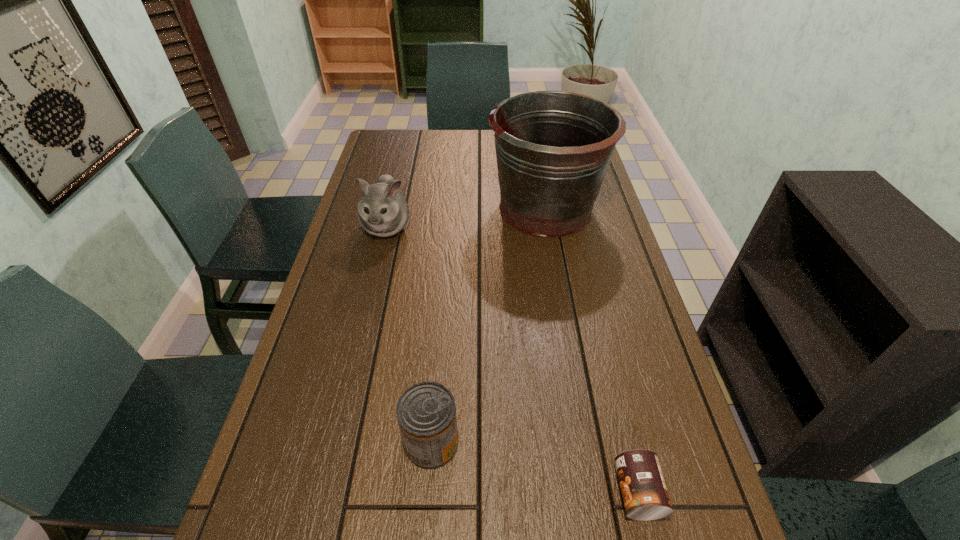
The height and width of the screenshot is (540, 960). Find the location of `empty location between the tallest object and the hamster`. empty location between the tallest object and the hamster is located at coordinates (466, 218).

You are a GUI agent. You are given a task and a screenshot of the screen. Output one action in this format:
    pyautogui.click(x=<x>, y=<y>)
    Task: Click on the free space between the third shortest object and the bucket
    This screenshot has height=540, width=960.
    Given the screenshot: What is the action you would take?
    (466, 218)

Where is `vacant point located between the bucket and the hamster`? The image size is (960, 540). vacant point located between the bucket and the hamster is located at coordinates pyautogui.click(x=466, y=218).

Find the location of `unoccupied position between the hamster and the right can`. unoccupied position between the hamster and the right can is located at coordinates (512, 359).

The width and height of the screenshot is (960, 540). In order to click on empty space that is in between the taller can and the bucket in this screenshot , I will do click(x=489, y=326).

Image resolution: width=960 pixels, height=540 pixels. In order to click on vacant point located between the bucket and the second object from left to right in this screenshot , I will do `click(489, 326)`.

This screenshot has height=540, width=960. In order to click on free area in between the second tallest object and the bucket in this screenshot , I will do `click(466, 218)`.

The image size is (960, 540). Identify the location of vacant space in between the second object from left to right and the tallest object. (489, 326).

I want to click on free area in between the bucket and the shorter can, so click(591, 350).

The height and width of the screenshot is (540, 960). In order to click on the closest object to the shorter can in this screenshot , I will do `click(426, 412)`.